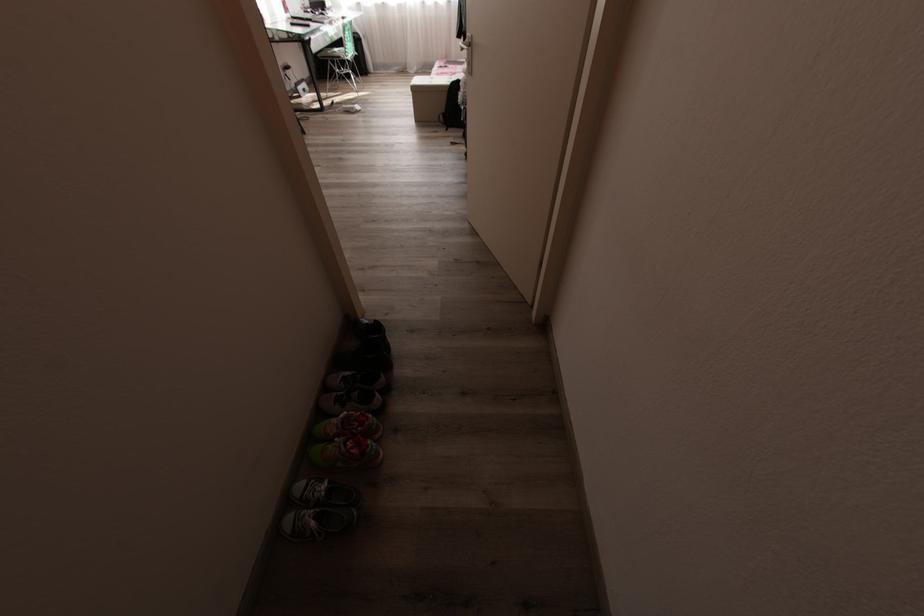
Identify the location of green and red shoe. (348, 426).